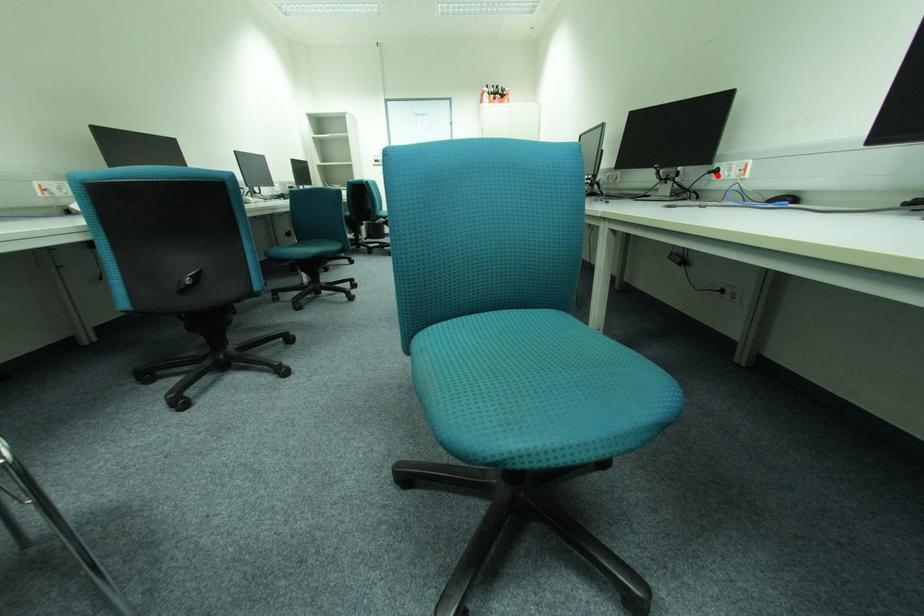
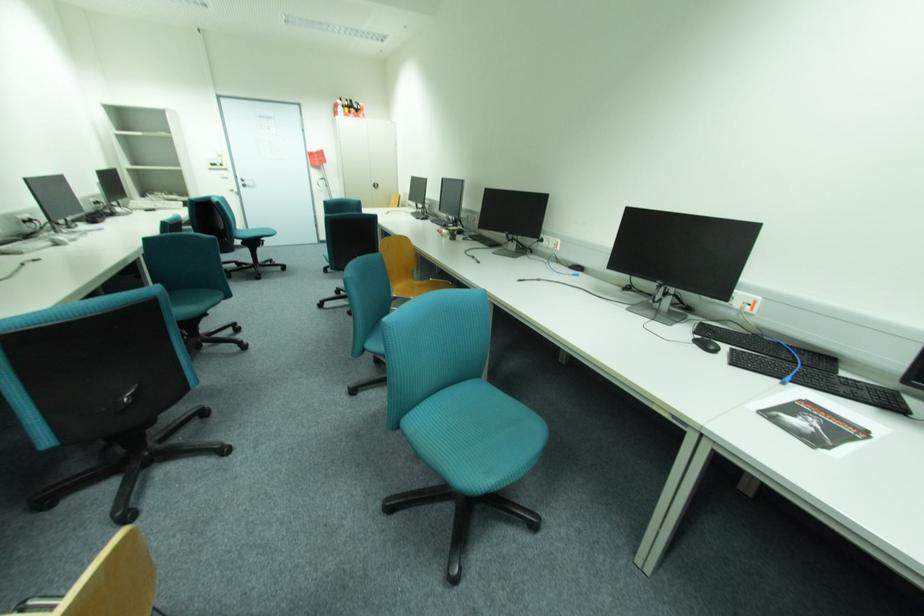
Where in the second image is the point corresponding to the highlighted location from the first image?

(544, 243)